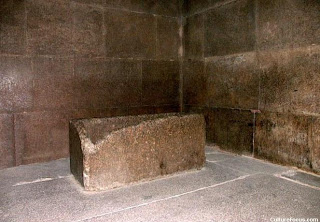
Identify the location of wall. (246, 89).